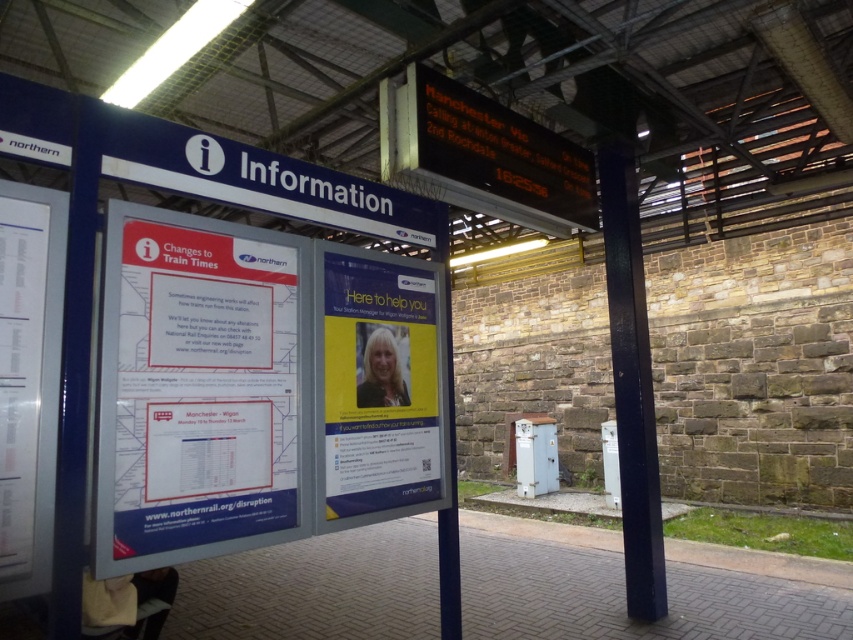
You are a commuter who wants to check both the yellow paper poster at center and the white paper at left on the information board. Since you can only reach up to 1.5 meters, which paper can you access without needing a stool?

The white paper at left is shorter than the yellow paper poster at center. Since the yellow paper poster at center is taller, it might be placed higher. However, without knowing their exact positions, we can only confirm that the white paper at left is shorter. If both are within your reach, the white paper at left is accessible. But since the question asks which can be accessed without a stool, and given the height difference, the white paper at left is shorter and possibly within reach, so you can access

You are standing at the train station platform and need to check both the yellow paper poster at center and the white paper at left. If you are currently facing the information board, which direction should you turn to first reach the closer one?

The yellow paper poster at center is 4.42 feet away from white paper at left. Since the yellow paper poster at center is closer to you, you should turn towards the center to reach it first.

You are standing at the train station and need to find the yellow paper poster at center. According to the scene description, where should you look relative to the information board?

The yellow paper poster at center is located at point (x=378, y=387) in 2D coordinates, which means it is positioned centrally on the information board.